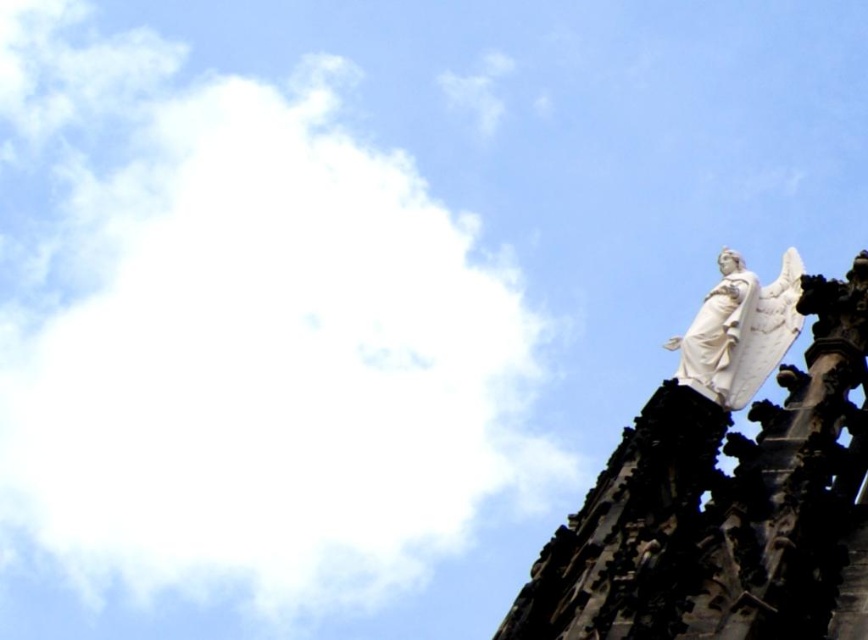
How distant is white fluffy cloud at upper left from white stone angel at upper right?

white fluffy cloud at upper left is 62.36 meters from white stone angel at upper right.

The image size is (868, 640). In order to click on white fluffy cloud at upper left in this screenshot , I will do `click(238, 342)`.

The width and height of the screenshot is (868, 640). I want to click on white fluffy cloud at upper left, so click(238, 342).